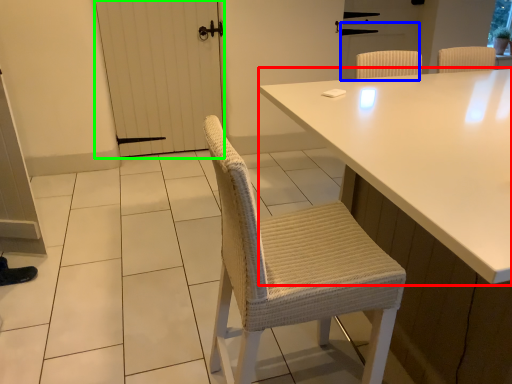
Question: Considering the real-world distances, which object is closest to table (highlighted by a red box)? screen door (highlighted by a blue box) or screen door (highlighted by a green box).

Choices:
 (A) screen door
 (B) screen door

Answer: (B)